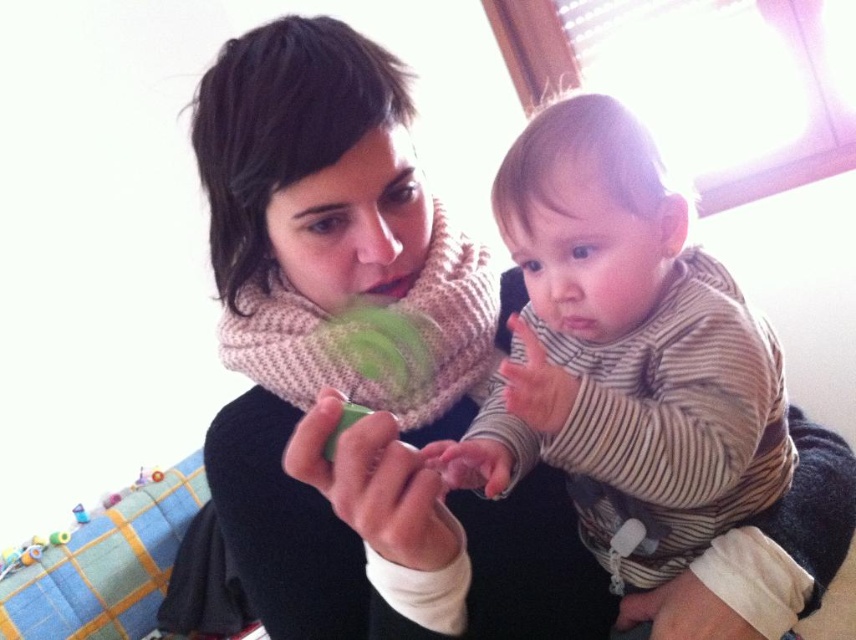
Who is shorter, white soft fabric at lower center or matte green toy at center?

With less height is white soft fabric at lower center.

Can you confirm if white soft fabric at lower center is thinner than matte green toy at center?

No.

What do you see at coordinates (682, 612) in the screenshot? I see `white soft fabric at lower center` at bounding box center [682, 612].

Locate an element on the screen. white soft fabric at lower center is located at coordinates (682, 612).

Can you confirm if striped cotton shirt at center is thinner than matte green toy at center?

Incorrect, striped cotton shirt at center's width is not less than matte green toy at center's.

Which is in front, point (591, 362) or point (533, 381)?

Point (533, 381)

Is point (768, 422) positioned before point (527, 342)?

No.

At what (x,y) coordinates should I click in order to perform the action: click on striped cotton shirt at center. Please return your answer as a coordinate pair (x, y). Image resolution: width=856 pixels, height=640 pixels. Looking at the image, I should click on (629, 353).

Can you confirm if striped cotton shirt at center is wider than green matte toy at center?

Correct, the width of striped cotton shirt at center exceeds that of green matte toy at center.

Measure the distance between striped cotton shirt at center and camera.

A distance of 21.44 inches exists between striped cotton shirt at center and camera.

The image size is (856, 640). What do you see at coordinates (629, 353) in the screenshot?
I see `striped cotton shirt at center` at bounding box center [629, 353].

Locate an element on the screen. The width and height of the screenshot is (856, 640). striped cotton shirt at center is located at coordinates (629, 353).